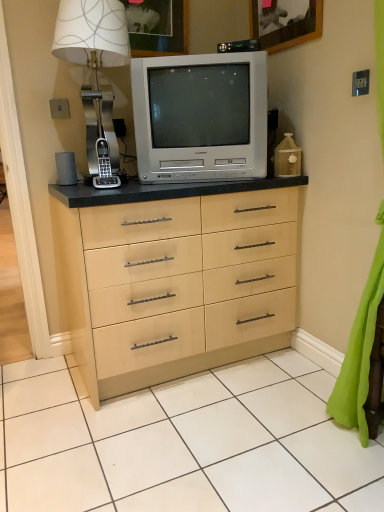
Question: In terms of height, does silver metallic television at center look taller or shorter compared to wooden picture frame at upper center, the 1th picture frame in the right-to-left sequence?

Choices:
 (A) tall
 (B) short

Answer: (A)

Question: From a real-world perspective, relative to wooden picture frame at upper center, the 2th picture frame when ordered from left to right, is silver metallic television at center vertically above or below?

Choices:
 (A) above
 (B) below

Answer: (B)

Question: Estimate the real-world distances between objects in this image. Which object is closer to the matte white picture frame at upper center, which is the 2th picture frame from right to left?

Choices:
 (A) wooden picture frame at upper center, the 1th picture frame in the right-to-left sequence
 (B) metallic silver table lamp at upper left
 (C) black plastic phone at left
 (D) green fabric curtain at lower right
 (E) silver metallic television at center

Answer: (B)

Question: Estimate the real-world distances between objects in this image. Which object is closer to the metallic silver table lamp at upper left?

Choices:
 (A) matte white picture frame at upper center, placed as the 1th picture frame when sorted from left to right
 (B) black plastic phone at left
 (C) wooden picture frame at upper center, the 2th picture frame when ordered from left to right
 (D) green fabric curtain at lower right
 (E) silver metallic television at center

Answer: (B)